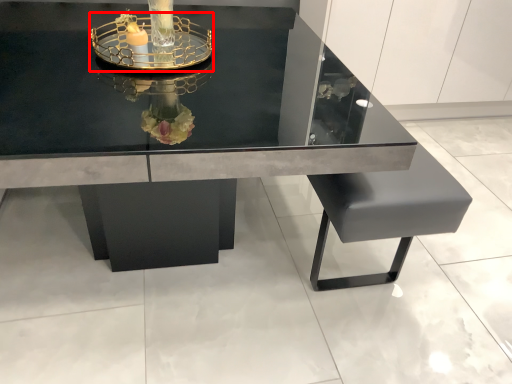
Question: From the image's perspective, what is the correct spatial positioning of glass box (annotated by the red box) in reference to table?

Choices:
 (A) above
 (B) below

Answer: (A)